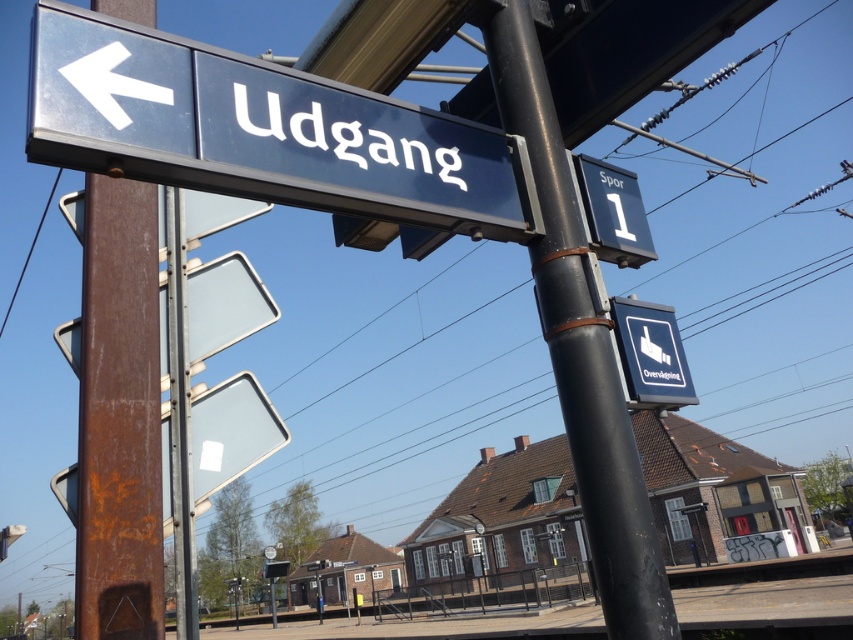
Question: Considering the relative positions of blue plastic sign at lower right and white plastic sign at upper center in the image provided, where is blue plastic sign at lower right located with respect to white plastic sign at upper center?

Choices:
 (A) right
 (B) left

Answer: (A)

Question: Does blue plastic sign at lower right appear on the left side of white plastic sign at upper center?

Choices:
 (A) no
 (B) yes

Answer: (A)

Question: Which object is closer to the camera taking this photo?

Choices:
 (A) blue metallic sign at upper left
 (B) black metal pole at center

Answer: (A)

Question: Among these points, which one is farthest from the camera?

Choices:
 (A) (483, 212)
 (B) (640, 200)

Answer: (B)

Question: Considering the real-world distances, which object is closest to the blue plastic sign at lower right?

Choices:
 (A) blue metallic sign at upper left
 (B) white plastic sign at upper center

Answer: (B)

Question: Does black metal pole at center appear over blue plastic sign at lower right?

Choices:
 (A) no
 (B) yes

Answer: (B)